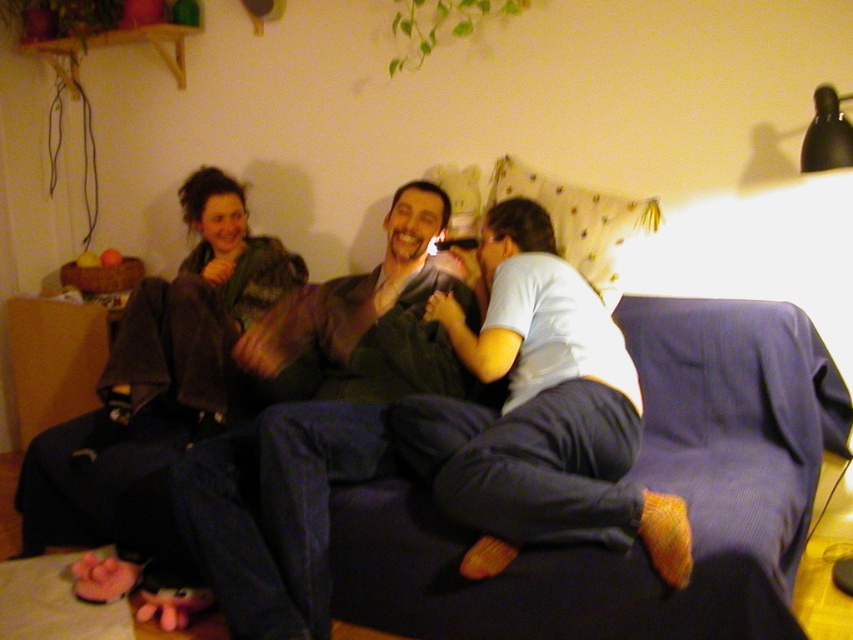
You are a guest entering the living room and want to sit next to the person wearing the shiny brown jacket at center. Which side of the blue corduroy couch at center should you choose to be closest to them?

The blue corduroy couch at center is positioned on the right side of the shiny brown jacket at center, so you should sit on the left side of the blue corduroy couch at center to be closest to them.

You are a photographer setting up a shoot in this living room. You need to place a small lamp between the blue corduroy couch at center and the shiny brown jacket at center. Based on their positions, where should the lamp be placed relative to the couch?

The blue corduroy couch at center is located below the shiny brown jacket at center, so the lamp should be placed above the couch to position it between the two objects.